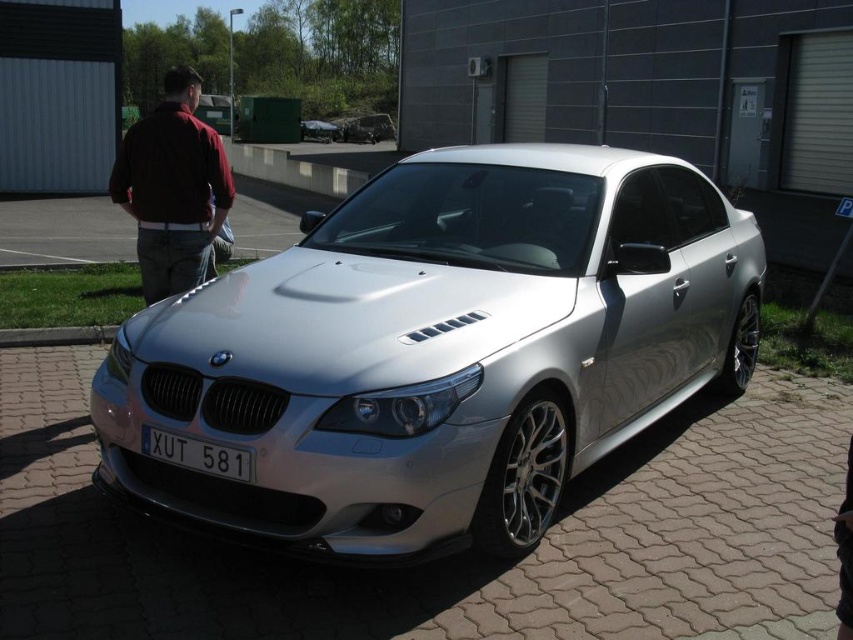
Looking at this image, you are a delivery person trying to read the license plate of the silver BMW sedan. However, the maroon fabric shirt at left is blocking your view. Can you move around to the other side of the car to see the white plastic license plate at center?

The white plastic license plate at center is behind the maroon fabric shirt at left, so moving to the other side of the car would allow you to see the license plate without obstruction.

You are a parking attendant and need to guide a driver to park their car so that the license plate is visible. The driver is currently parked with the satin silver car at center blocking the white plastic license plate at center. How should the driver adjust their parking position?

The satin silver car at center is currently in front of the white plastic license plate at center. To make the license plate visible, the driver should move the car backward so that the white plastic license plate at center is no longer blocked.

From the picture: You are a photographer trying to capture the maroon fabric shirt at left and the white plastic license plate at center in the same frame. Based on their sizes, which object should you focus on first to ensure both are in focus?

The maroon fabric shirt at left has a larger size compared to the white plastic license plate at center, so you should focus on the maroon fabric shirt at left first to ensure both are in focus since it is larger and requires more attention.